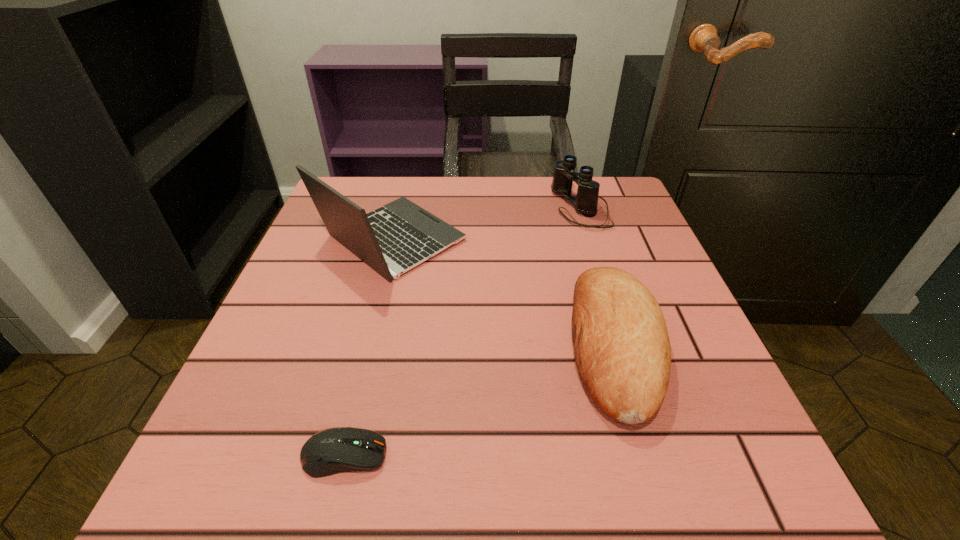
Identify the location of the tallest object. Image resolution: width=960 pixels, height=540 pixels. (393, 239).

The width and height of the screenshot is (960, 540). I want to click on binoculars, so click(586, 201).

You are a GUI agent. You are given a task and a screenshot of the screen. Output one action in this format:
    pyautogui.click(x=<x>, y=<y>)
    Task: Click on the bread
    
    Given the screenshot: What is the action you would take?
    pyautogui.click(x=622, y=350)

You are a GUI agent. You are given a task and a screenshot of the screen. Output one action in this format:
    pyautogui.click(x=<x>, y=<y>)
    Task: Click on the computer equipment
    The width and height of the screenshot is (960, 540).
    Given the screenshot: What is the action you would take?
    pyautogui.click(x=335, y=450)

This screenshot has height=540, width=960. What are the coordinates of `free space located at the front screen of the laptop_computer` in the screenshot? It's located at (504, 240).

Where is `blank space located 0.290m on the left of the binoculars`? The image size is (960, 540). blank space located 0.290m on the left of the binoculars is located at coordinates (431, 207).

Where is `vacant region located 0.370m on the back of the bread`? The image size is (960, 540). vacant region located 0.370m on the back of the bread is located at coordinates (567, 185).

Locate an element on the screen. This screenshot has width=960, height=540. free space located 0.310m on the button of the shortest object is located at coordinates (620, 455).

I want to click on laptop_computer positioned at the far edge, so click(393, 239).

Locate an element on the screen. The image size is (960, 540). binoculars that is at the far edge is located at coordinates (586, 201).